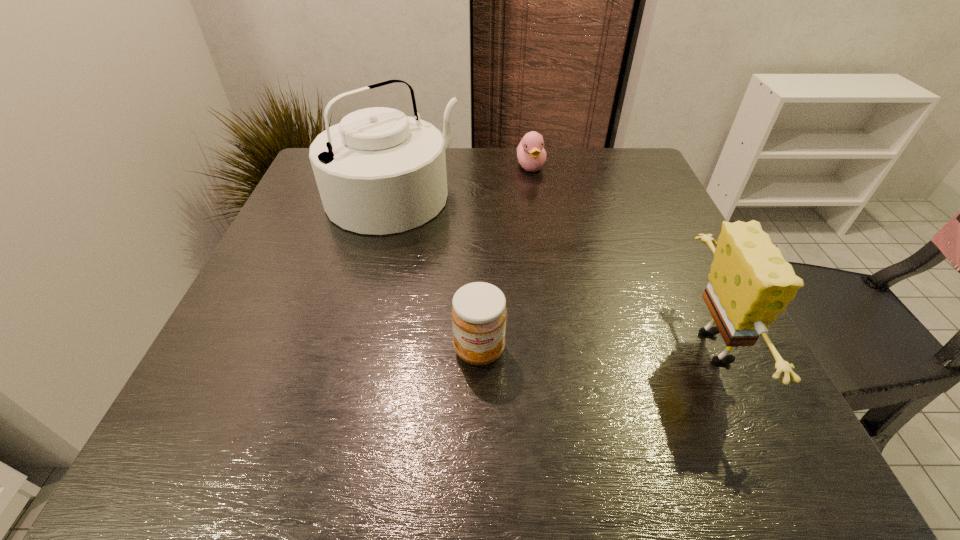
I want to click on vacant space located on the spout of the leftmost object, so click(512, 291).

Identify the location of vacant area located 0.180m on the spout of the leftmost object. (x=482, y=267).

Find the location of a particular element. vacant area located on the spout of the leftmost object is located at coordinates (464, 253).

You are a GUI agent. You are given a task and a screenshot of the screen. Output one action in this format:
    pyautogui.click(x=<x>, y=<y>)
    Task: Click on the duckling that is at the far edge
    
    Given the screenshot: What is the action you would take?
    pyautogui.click(x=531, y=154)

You are a GUI agent. You are given a task and a screenshot of the screen. Output one action in this format:
    pyautogui.click(x=<x>, y=<y>)
    Task: Click on the kettle present at the far edge
    
    Given the screenshot: What is the action you would take?
    pyautogui.click(x=378, y=171)

At what (x,y) coordinates should I click in order to perform the action: click on jam that is at the near edge. Please return your answer as a coordinate pair (x, y). The height and width of the screenshot is (540, 960). Looking at the image, I should click on (479, 313).

At what (x,y) coordinates should I click in order to perform the action: click on sponge situated at the near edge. Please return your answer as a coordinate pair (x, y). This screenshot has height=540, width=960. Looking at the image, I should click on (750, 283).

Where is `object present at the left edge`? The height and width of the screenshot is (540, 960). object present at the left edge is located at coordinates (378, 171).

Identify the location of object that is at the right edge. coord(750,283).

You are a GUI agent. You are given a task and a screenshot of the screen. Output one action in this format:
    pyautogui.click(x=<x>, y=<y>)
    Task: Click on the object present at the far left corner
    The image size is (960, 540).
    Given the screenshot: What is the action you would take?
    pyautogui.click(x=378, y=171)